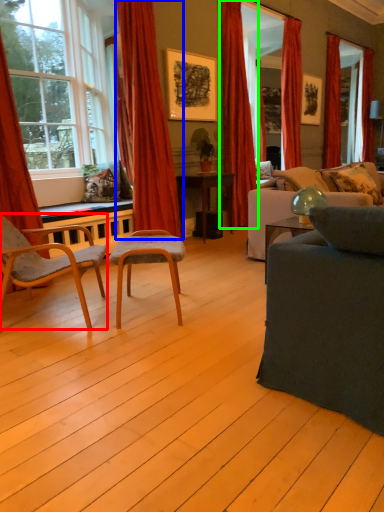
Question: Which object is positioned closest to chair (highlighted by a red box)? Select from curtain (highlighted by a blue box) and curtain (highlighted by a green box).

Choices:
 (A) curtain
 (B) curtain

Answer: (A)